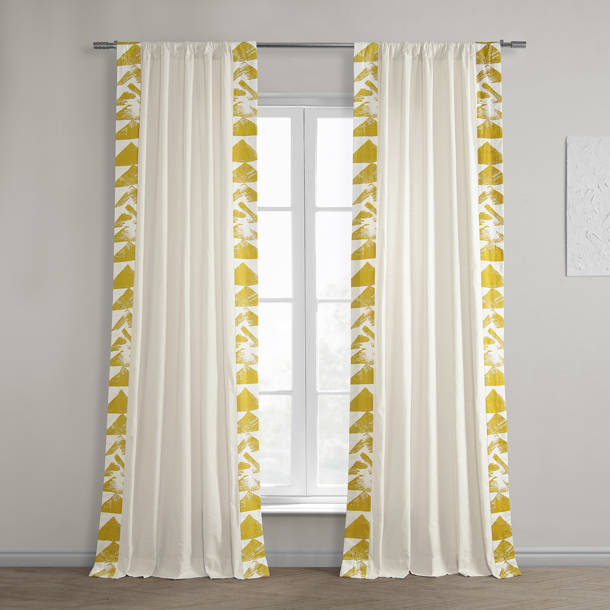
You are a GUI agent. You are given a task and a screenshot of the screen. Output one action in this format:
    pyautogui.click(x=<x>, y=<y>)
    Task: Click on the left-hand section of curtains
    This screenshot has width=610, height=610.
    Given the screenshot: What is the action you would take?
    pyautogui.click(x=185, y=338)